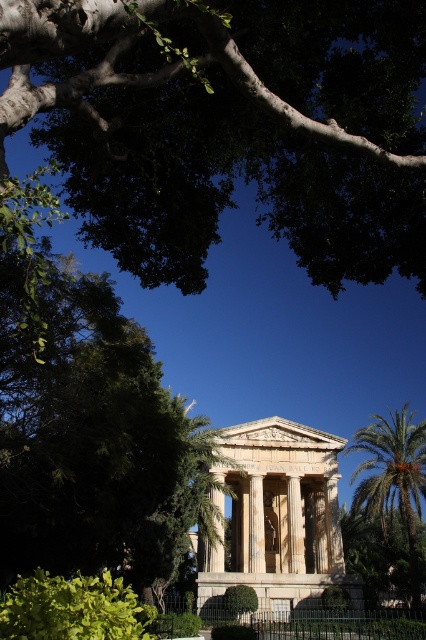
Question: Considering the real-world distances, which object is farthest from the green leafy palm at right?

Choices:
 (A) green leafy hedge at lower left
 (B) marble temple at center

Answer: (A)

Question: Which object appears farthest from the camera in this image?

Choices:
 (A) marble temple at center
 (B) green leafy tree at upper center
 (C) green leafy palm at right

Answer: (C)

Question: Which point is closer to the camera taking this photo?

Choices:
 (A) (120, 593)
 (B) (359, 442)
 (C) (275, 477)

Answer: (A)

Question: Is green leafy tree at upper center to the right of marble temple at center from the viewer's perspective?

Choices:
 (A) no
 (B) yes

Answer: (A)

Question: Is green leafy palm at right to the right of green leafy bush at center from the viewer's perspective?

Choices:
 (A) yes
 (B) no

Answer: (A)

Question: Can you confirm if marble temple at center is positioned below green leafy bush at center?

Choices:
 (A) no
 (B) yes

Answer: (A)